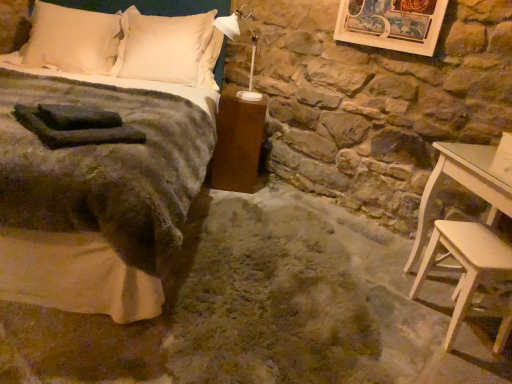
Locate an element on the screen. This screenshot has width=512, height=384. free region on the left part of light beige wood stool at lower right is located at coordinates (400, 322).